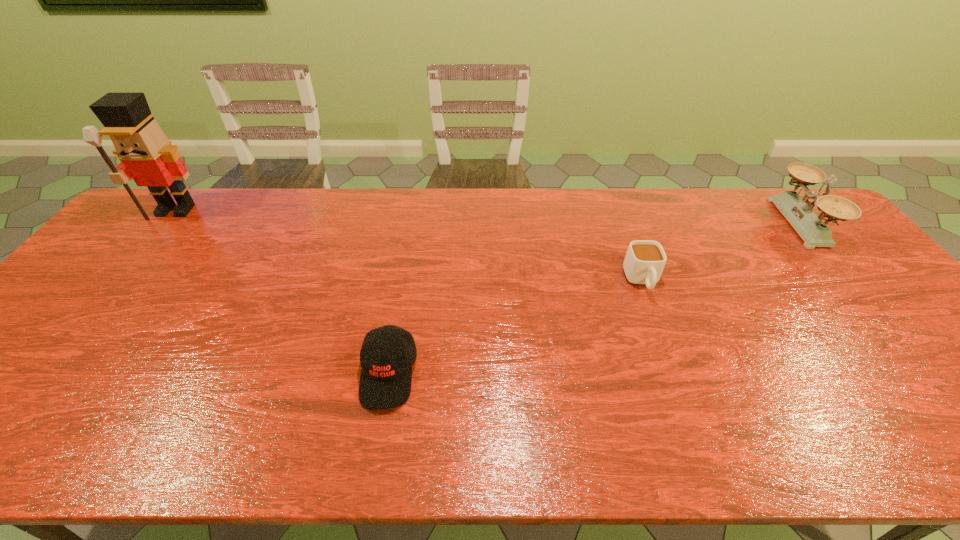
Image resolution: width=960 pixels, height=540 pixels. Find the location of `free spot at the near edge of the desktop`. free spot at the near edge of the desktop is located at coordinates (320, 443).

In the image, there is a desktop. Find the location of `vacant space at the left edge`. vacant space at the left edge is located at coordinates (71, 322).

Image resolution: width=960 pixels, height=540 pixels. In order to click on vacant space at the right edge of the desktop in this screenshot , I will do `click(866, 319)`.

I want to click on vacant area that lies between the nutcracker and the third object from left to right, so click(x=409, y=246).

The height and width of the screenshot is (540, 960). What are the coordinates of `free space between the third object from right to left and the rightmost object` in the screenshot? It's located at (594, 299).

The height and width of the screenshot is (540, 960). Identify the location of free spot between the baseball cap and the rightmost object. (594, 299).

You are a GUI agent. You are given a task and a screenshot of the screen. Output one action in this format:
    pyautogui.click(x=<x>, y=<y>)
    Task: Click on the free point between the nutcracker and the third shortest object
    The width and height of the screenshot is (960, 540).
    Given the screenshot: What is the action you would take?
    pyautogui.click(x=488, y=217)

Locate an element on the screen. The width and height of the screenshot is (960, 540). free space between the scale and the second object from right to left is located at coordinates (721, 252).

Where is `empty location between the nearest object and the scale`? This screenshot has height=540, width=960. empty location between the nearest object and the scale is located at coordinates (594, 299).

The height and width of the screenshot is (540, 960). I want to click on free space between the nearest object and the second tallest object, so click(594, 299).